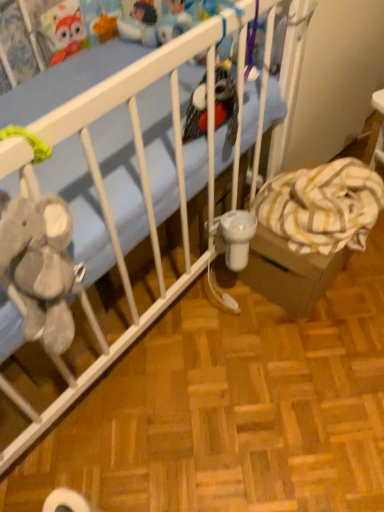
The width and height of the screenshot is (384, 512). In order to click on free location in front of striped fabric cardboard box at lower right in this screenshot , I will do `click(312, 345)`.